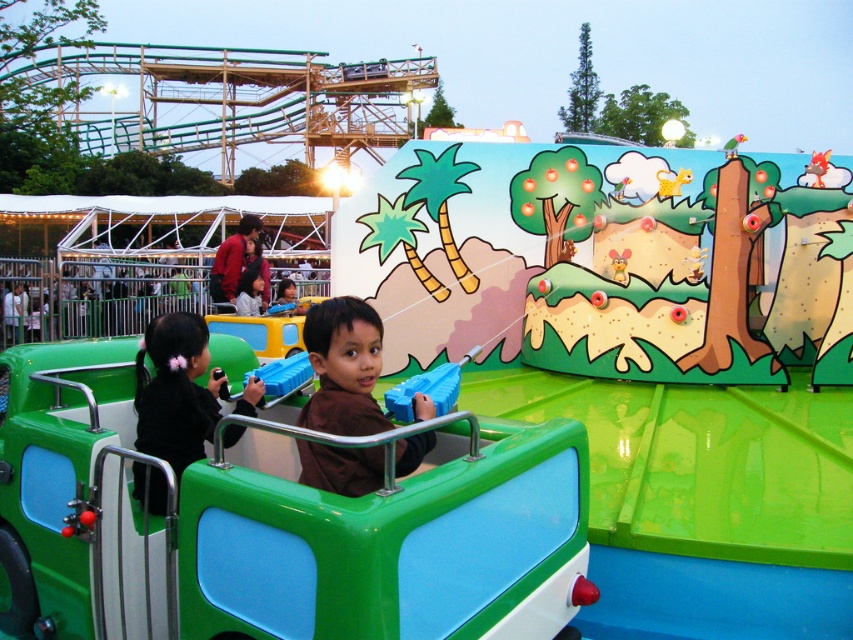
You are a photographer trying to capture a photo of the two children in the ride. You notice the brown matte shirt at center and the black matte hair at center. Which object is shorter in height?

The brown matte shirt at center has a lesser height compared to the black matte hair at center, so the brown matte shirt at center is shorter in height.

You are a safety inspector checking the ride for potential hazards. You notice the black matte hair at center and the blue plastic handle at center. Which object is wider, and could this pose a safety concern if a child reaches out?

The black matte hair at center is wider than the blue plastic handle at center. This could pose a safety concern if a child reaches out because the wider hair might be more likely to get caught or tangled in moving parts of the ride.

What are the coordinates of the brown matte shirt at center?

The brown matte shirt at center is located at point (343,368).